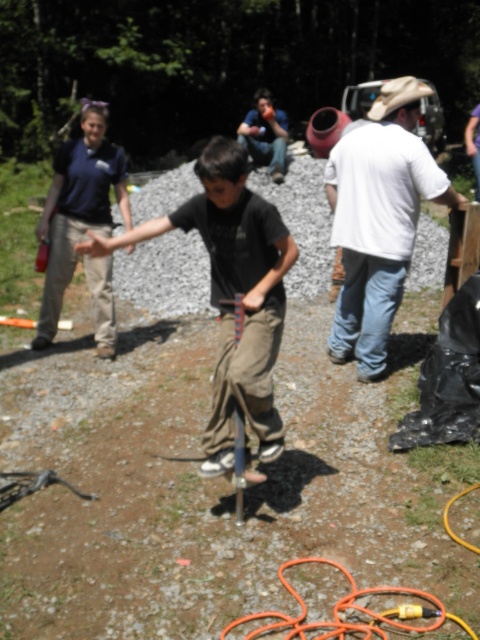
Question: Can you confirm if matte black shirt at center is smaller than orange rubber hose at lower center?

Choices:
 (A) yes
 (B) no

Answer: (B)

Question: Is matte black shirt at center to the right of white cotton shirt at right from the viewer's perspective?

Choices:
 (A) no
 (B) yes

Answer: (A)

Question: Is white cotton shirt at right above orange rubber hose at lower center?

Choices:
 (A) no
 (B) yes

Answer: (B)

Question: Which of these objects is positioned farthest from the matte black shirt at center?

Choices:
 (A) white cotton shirt at right
 (B) orange rubber hose at lower center

Answer: (A)

Question: Which of the following is the farthest from the observer?

Choices:
 (A) matte black shirt at center
 (B) white cotton shirt at right
 (C) orange rubber hose at lower center

Answer: (B)

Question: Which point is closer to the camera?

Choices:
 (A) (228, 429)
 (B) (385, 161)
 (C) (243, 636)

Answer: (C)